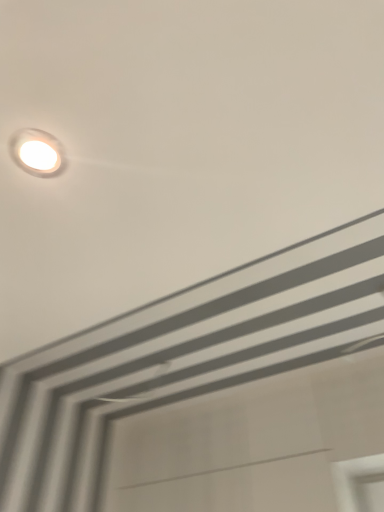
The image size is (384, 512). Find the location of `matte white lamp at upper left`. matte white lamp at upper left is located at coordinates (38, 152).

Describe the element at coordinates (38, 152) in the screenshot. The width and height of the screenshot is (384, 512). I see `matte white lamp at upper left` at that location.

Locate an element on the screen. The height and width of the screenshot is (512, 384). matte white lamp at upper left is located at coordinates (38, 152).